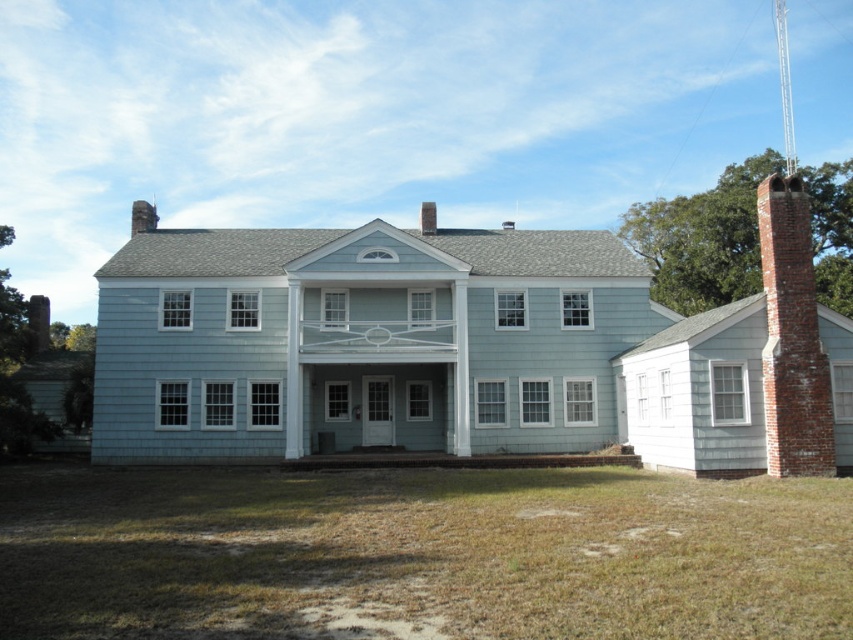
You are standing at the front of the house and want to locate two specific points marked on the image. The first point is at coordinates point (814,458) and the second is at point (30,346). Which of these points is closer to you?

Point (814,458) is in front of point (30,346), so the first point is closer to you.